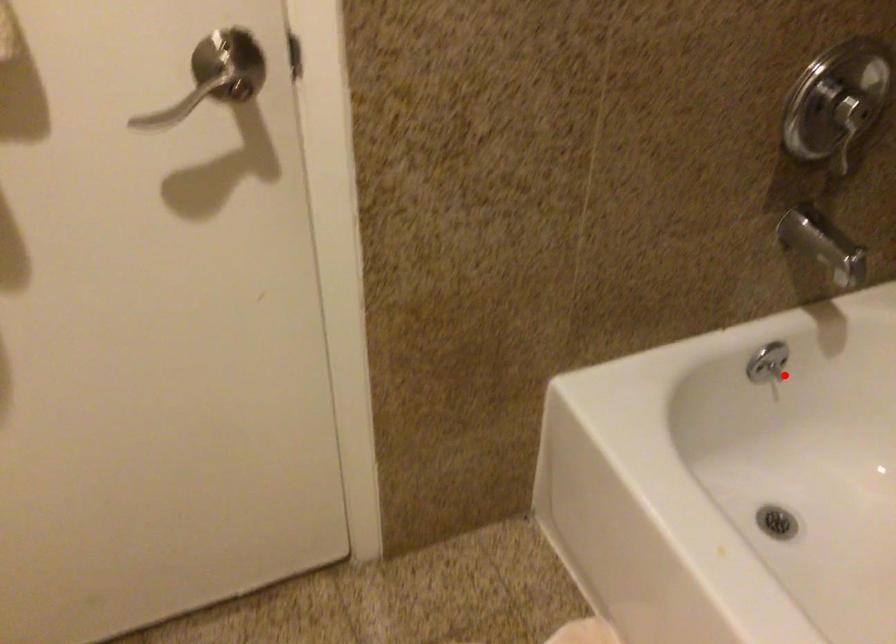
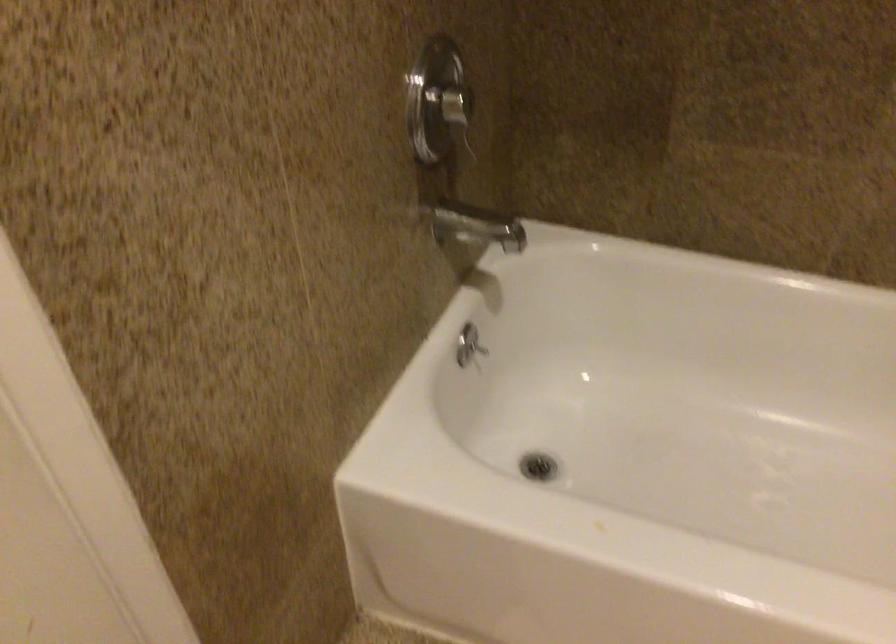
Where in the second image is the point corresponding to the highlighted location from the first image?

(478, 348)